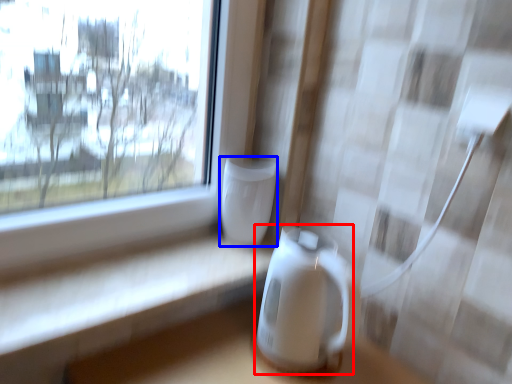
Question: Among these objects, which one is farthest to the camera, appliance (highlighted by a red box) or appliance (highlighted by a blue box)?

Choices:
 (A) appliance
 (B) appliance

Answer: (B)